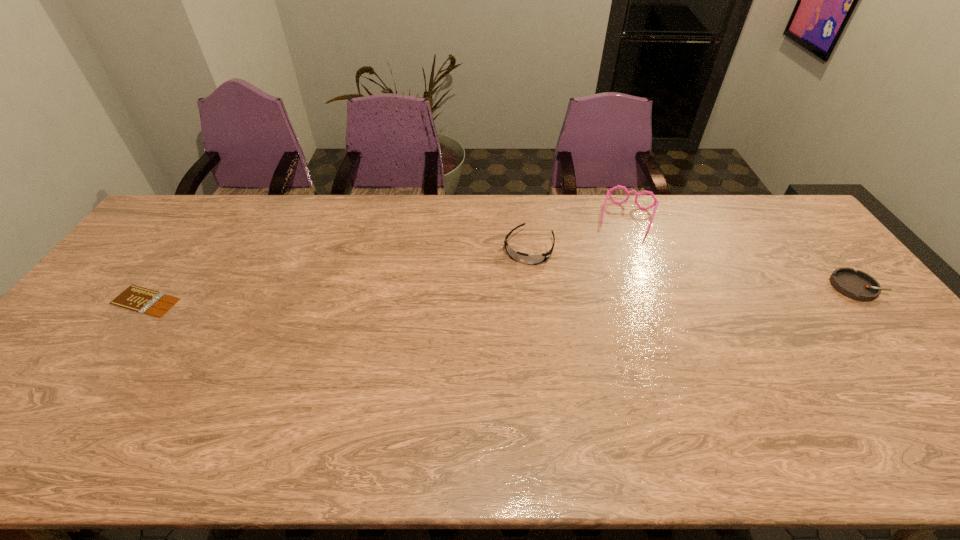
Where is `the shortest object`? Image resolution: width=960 pixels, height=540 pixels. the shortest object is located at coordinates (135, 298).

What are the coordinates of `the leftmost object` in the screenshot? It's located at (135, 298).

Find the location of a particular element. This screenshot has height=540, width=960. ashtray is located at coordinates (857, 285).

The image size is (960, 540). Identify the location of the second shortest object. (857, 285).

Identify the location of the third object from right to left. (516, 255).

You are a GUI agent. You are given a task and a screenshot of the screen. Output one action in this format:
    pyautogui.click(x=<x>, y=<y>)
    Task: Click on the second tallest object
    
    Given the screenshot: What is the action you would take?
    pyautogui.click(x=516, y=255)

At what (x,y) coordinates should I click in order to perform the action: click on the third object from left to right. Please return your answer as a coordinate pair (x, y). Looking at the image, I should click on (656, 201).

Where is `spectacles`? The width and height of the screenshot is (960, 540). spectacles is located at coordinates (656, 201).

Find the location of a particular element. The width and height of the screenshot is (960, 540). free spot located on the back of the chocolate bar is located at coordinates (192, 237).

Where is `blank space located 0.350m on the back of the rightmost object`? blank space located 0.350m on the back of the rightmost object is located at coordinates (786, 204).